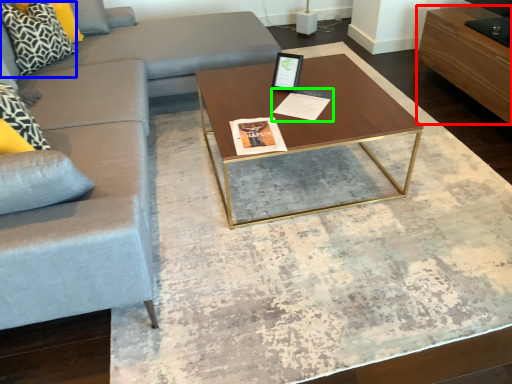
Question: Which object is positioned closest to drawer (highlighted by a red box)? Select from pillow (highlighted by a blue box) and magazine (highlighted by a green box).

Choices:
 (A) pillow
 (B) magazine

Answer: (B)